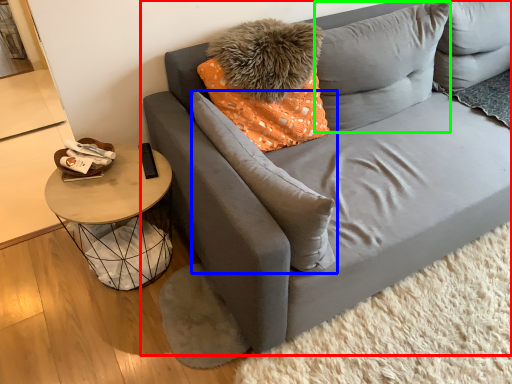
Question: Which object is the farthest from studio couch (highlighted by a red box)? Choose among these: pillow (highlighted by a blue box) or pillow (highlighted by a green box).

Choices:
 (A) pillow
 (B) pillow

Answer: (A)